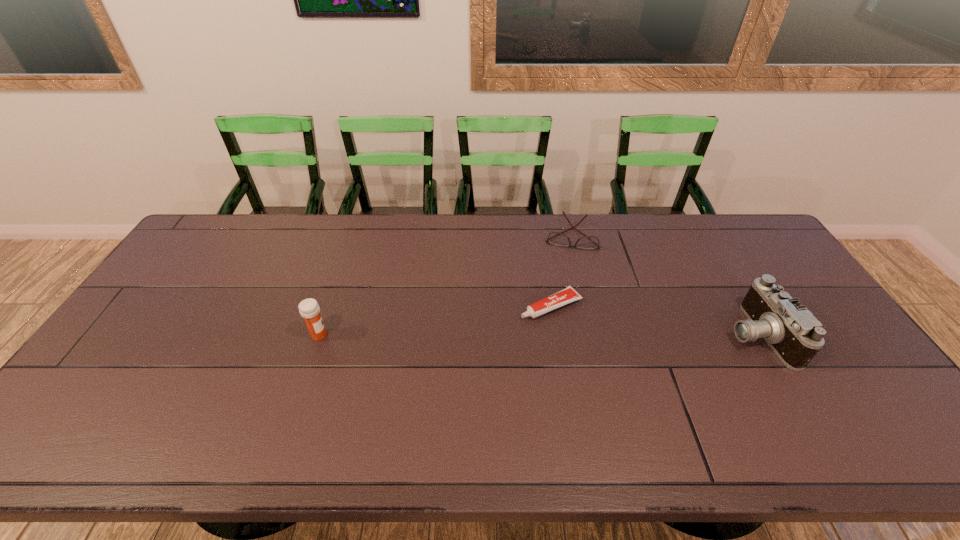
Identify the location of free space at the right edge of the desktop. The image size is (960, 540). (739, 262).

Identify the location of free spot at the near left corner of the desktop. The width and height of the screenshot is (960, 540). (104, 389).

This screenshot has height=540, width=960. What are the coordinates of `free space at the far right corner of the desktop` in the screenshot? It's located at (744, 215).

Where is `empty space that is in between the medicine and the spectacles`? This screenshot has height=540, width=960. empty space that is in between the medicine and the spectacles is located at coordinates (444, 286).

Find the location of `vacant point located between the farthest object and the medicine`. vacant point located between the farthest object and the medicine is located at coordinates (444, 286).

This screenshot has width=960, height=540. I want to click on free space between the farthest object and the rightmost object, so click(662, 286).

Identify the location of free space between the farthest object and the toothpaste. The image size is (960, 540). (561, 271).

Where is `free spot between the spectacles and the toothpaste`? free spot between the spectacles and the toothpaste is located at coordinates (561, 271).

Identify the location of free spot between the leftmost object and the farthest object. The width and height of the screenshot is (960, 540). (444, 286).

Image resolution: width=960 pixels, height=540 pixels. What are the coordinates of `unoccupied area between the spectacles and the leftmost object` in the screenshot? It's located at tap(444, 286).